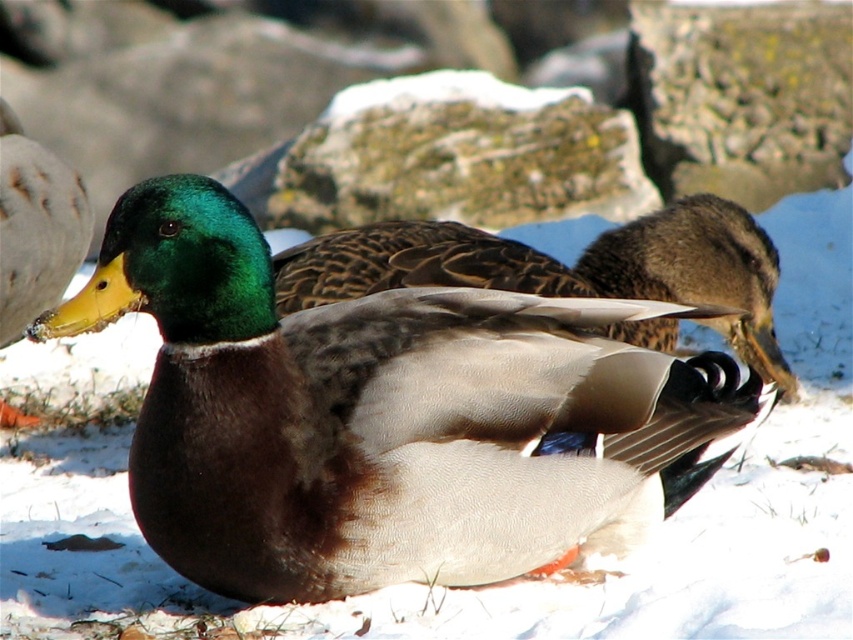
You are a wildlife photographer aiming to capture a closeup shot of both the shiny brown duck at center and the brown textured duck at center. Given their sizes, which duck would require you to zoom in more to fill the frame?

The shiny brown duck at center is smaller compared to the brown textured duck at center, so you would need to zoom in more on the shiny brown duck at center to fill the frame.

You are a wildlife photographer aiming to capture a clear image of both the shiny brown duck at center and the brown textured duck at center. Since you want both ducks to be in focus, which duck should you adjust your camera focus on first?

The shiny brown duck at center is in front of the brown textured duck at center, so you should focus on the shiny brown duck at center first to ensure both are in focus.

Looking at this image, you are a photographer trying to capture a closeup of the shiny brown duck at center and the brown textured duck at center. Which duck should you focus on if you want the other duck to be slightly out of focus?

You should focus on the shiny brown duck at center because it is positioned on the left side of the brown textured duck at center, so focusing on the one closer to you will keep it sharp while the other may be slightly blurred.